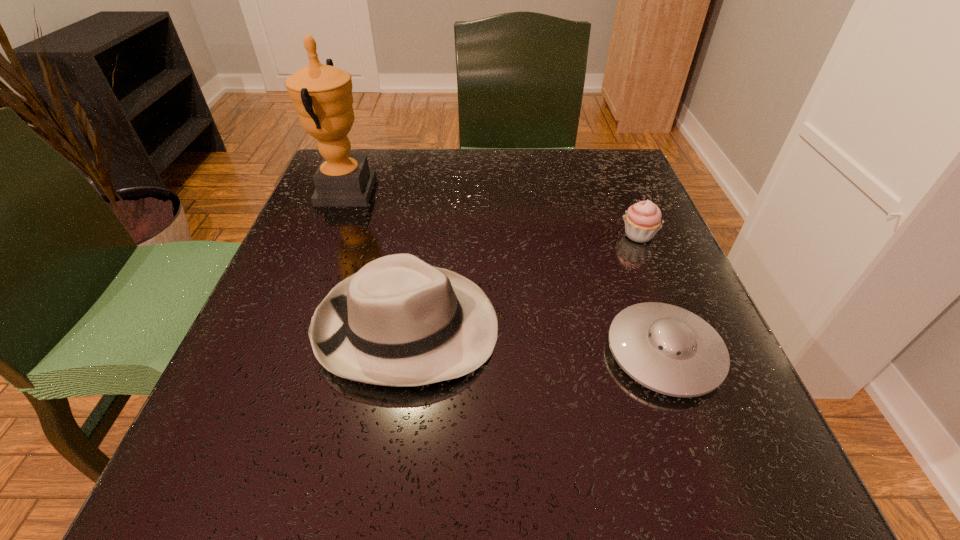
Identify the location of the tallest object. (322, 95).

Locate an element on the screen. The image size is (960, 540). the farthest object is located at coordinates tap(322, 95).

This screenshot has height=540, width=960. Identify the location of fedora. (398, 321).

Where is `the third tallest object`? This screenshot has width=960, height=540. the third tallest object is located at coordinates (642, 220).

Locate an element on the screen. the third nearest object is located at coordinates (642, 220).

Locate an element on the screen. The width and height of the screenshot is (960, 540). saucer is located at coordinates (668, 349).

You are a GUI agent. You are given a task and a screenshot of the screen. Output one action in this format:
    pyautogui.click(x=<x>, y=<y>)
    Task: Click on the vacant space situated at the front of the award with handles
    This screenshot has height=540, width=960.
    Given the screenshot: What is the action you would take?
    pyautogui.click(x=520, y=192)

Identify the location of free space located 0.120m on the front-facing side of the fedora. This screenshot has width=960, height=540. (574, 327).

Image resolution: width=960 pixels, height=540 pixels. Find the location of `vacant space located on the front of the second shortest object`. vacant space located on the front of the second shortest object is located at coordinates (677, 329).

Where is `free space located on the back of the saucer`? free space located on the back of the saucer is located at coordinates [602, 183].